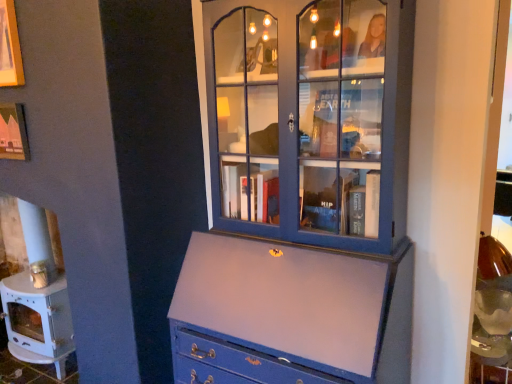
Find the location of a particular element. white glossy fireplace at lower left is located at coordinates click(x=34, y=286).

Measure the distance between white glossy fireplace at lower left and camera.

white glossy fireplace at lower left and camera are 2.19 meters apart.

The width and height of the screenshot is (512, 384). Describe the element at coordinates (34, 286) in the screenshot. I see `white glossy fireplace at lower left` at that location.

What do you see at coordinates (310, 119) in the screenshot? This screenshot has height=384, width=512. I see `blue painted wood cabinet at center` at bounding box center [310, 119].

Where is `blue painted wood cabinet at center`? blue painted wood cabinet at center is located at coordinates (310, 119).

You are a GUI agent. You are given a task and a screenshot of the screen. Output one action in this format:
    pyautogui.click(x=<x>, y=<y>)
    Task: Click on the white glossy fireplace at lower left
    This screenshot has height=384, width=512.
    Given the screenshot: What is the action you would take?
    pyautogui.click(x=34, y=286)

From the picture: Is blue painted wood cabinet at center at the left side of white glossy fireplace at lower left?

Incorrect, blue painted wood cabinet at center is not on the left side of white glossy fireplace at lower left.

Is blue painted wood cabinet at center in front of white glossy fireplace at lower left?

Yes, the depth of blue painted wood cabinet at center is less than that of white glossy fireplace at lower left.

Which is less distant, (290, 224) or (19, 347)?

Point (290, 224) is closer to the camera than point (19, 347).

From the image's perspective, would you say blue painted wood cabinet at center is positioned over white glossy fireplace at lower left?

Yes.

From a real-world perspective, which is physically above, blue painted wood cabinet at center or white glossy fireplace at lower left?

blue painted wood cabinet at center, from a real-world perspective.

Is blue painted wood cabinet at center thinner than white glossy fireplace at lower left?

No.

Between blue painted wood cabinet at center and white glossy fireplace at lower left, which one has more height?

With more height is blue painted wood cabinet at center.

Considering the sizes of objects blue painted wood cabinet at center and white glossy fireplace at lower left in the image provided, who is smaller, blue painted wood cabinet at center or white glossy fireplace at lower left?

With smaller size is white glossy fireplace at lower left.

Would you say white glossy fireplace at lower left is part of blue painted wood cabinet at center's contents?

No, white glossy fireplace at lower left is located outside of blue painted wood cabinet at center.

Is blue painted wood cabinet at center beside white glossy fireplace at lower left?

blue painted wood cabinet at center is not next to white glossy fireplace at lower left, and they're not touching.

Is blue painted wood cabinet at center positioned with its back to white glossy fireplace at lower left?

No.

How much distance is there between blue painted wood cabinet at center and white glossy fireplace at lower left?

1.48 meters.

Where is `cupboard above the white glossy fireplace at lower left (from the image's perspective)`? Image resolution: width=512 pixels, height=384 pixels. cupboard above the white glossy fireplace at lower left (from the image's perspective) is located at coordinates click(310, 119).

Which object is positioned more to the right, white glossy fireplace at lower left or blue painted wood cabinet at center?

blue painted wood cabinet at center.

Does white glossy fireplace at lower left come in front of blue painted wood cabinet at center?

That is False.

Which is closer to the camera, (x=14, y=198) or (x=234, y=212)?

Positioned in front is point (x=234, y=212).

From the image's perspective, is white glossy fireplace at lower left located above or below blue painted wood cabinet at center?

white glossy fireplace at lower left is situated lower than blue painted wood cabinet at center in the image.

From a real-world perspective, is white glossy fireplace at lower left physically above blue painted wood cabinet at center?

Actually, white glossy fireplace at lower left is physically below blue painted wood cabinet at center in the real world.

Looking at their sizes, would you say white glossy fireplace at lower left is wider or thinner than blue painted wood cabinet at center?

Considering their sizes, white glossy fireplace at lower left looks slimmer than blue painted wood cabinet at center.

Who is taller, white glossy fireplace at lower left or blue painted wood cabinet at center?

Standing taller between the two is blue painted wood cabinet at center.

In terms of size, does white glossy fireplace at lower left appear bigger or smaller than blue painted wood cabinet at center?

white glossy fireplace at lower left is smaller than blue painted wood cabinet at center.

Is white glossy fireplace at lower left outside of blue painted wood cabinet at center?

Yes.

Is white glossy fireplace at lower left with blue painted wood cabinet at center?

There is a gap between white glossy fireplace at lower left and blue painted wood cabinet at center.

Is white glossy fireplace at lower left aimed at blue painted wood cabinet at center?

No.

How different are the orientations of white glossy fireplace at lower left and blue painted wood cabinet at center in degrees?

The angular difference between white glossy fireplace at lower left and blue painted wood cabinet at center is 0.469 degrees.

Based on the photo, how much distance is there between white glossy fireplace at lower left and blue painted wood cabinet at center?

They are 1.48 meters apart.

I want to click on cupboard in front of the white glossy fireplace at lower left, so click(x=310, y=119).

This screenshot has width=512, height=384. I want to click on cupboard that appears on the right of white glossy fireplace at lower left, so click(x=310, y=119).

At what (x,y) coordinates should I click in order to perform the action: click on cupboard lying in front of the white glossy fireplace at lower left. Please return your answer as a coordinate pair (x, y). The height and width of the screenshot is (384, 512). Looking at the image, I should click on (310, 119).